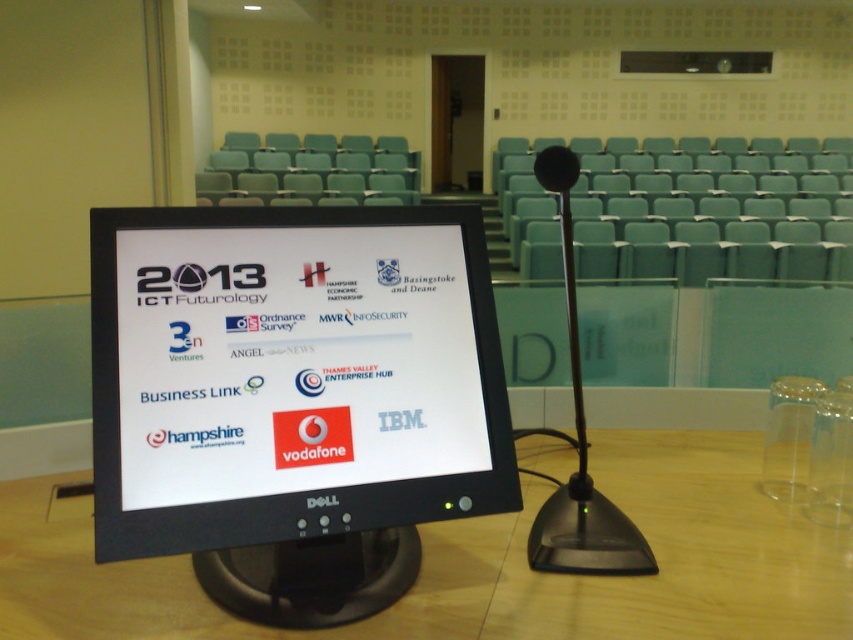
You are organizing a presentation and need to place a laptop and some documents on the wooden table at center. Considering the black plastic monitor at center is already on the table, will there be enough space for both the laptop and documents?

The black plastic monitor at center occupies less space than wooden table at center, so there should be enough space left on the wooden table at center to place both the laptop and documents.

You are setting up a presentation in a conference room. You have a black plastic monitor at center and a wooden table at center. Which object is placed on top of the other?

The black plastic monitor at center is positioned over wooden table at center, so the monitor is placed on top of the table.